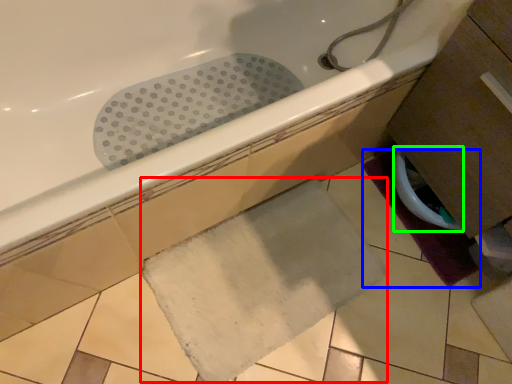
Question: Which object is the closest to the bath mat (highlighted by a red box)? Choose among these: bath mat (highlighted by a blue box) or toilet bowl (highlighted by a green box).

Choices:
 (A) bath mat
 (B) toilet bowl

Answer: (A)